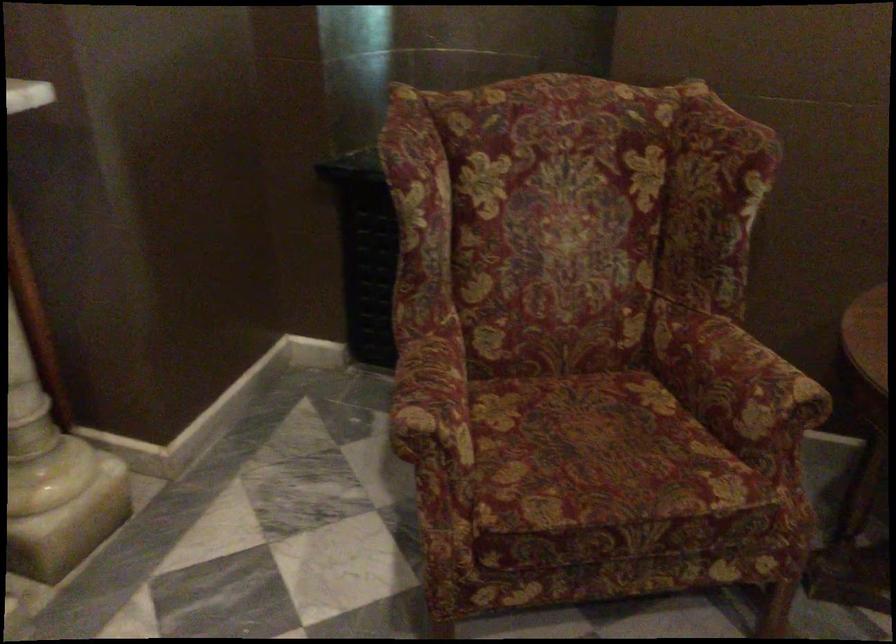
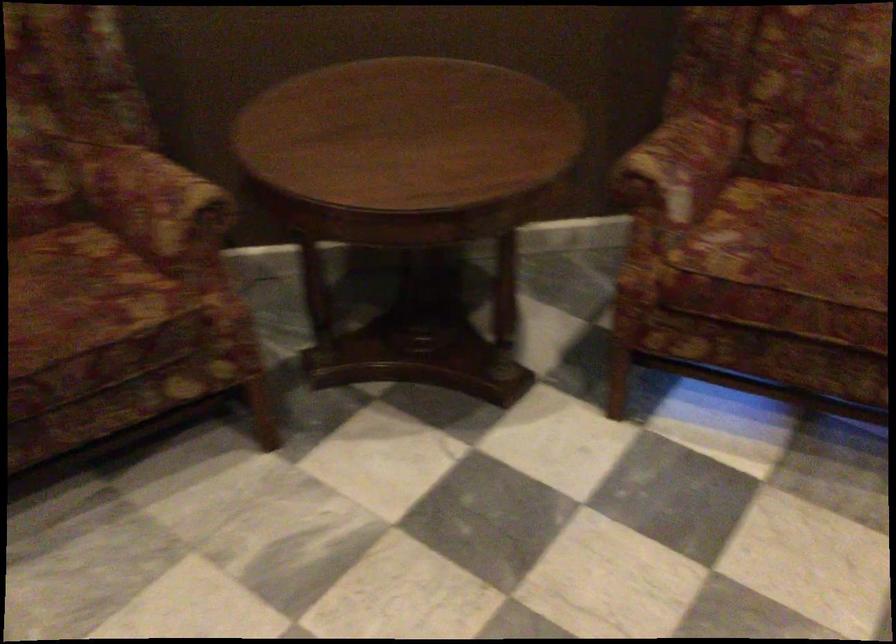
Question: Which direction would the cameraman need to move to produce the second image? Reply with the corresponding letter.

Choices:
 (A) Left
 (B) Right
 (C) Forward
 (D) Backward

Answer: (B)